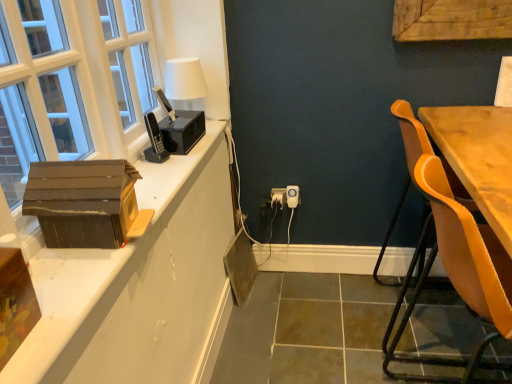
Question: Considering the relative sizes of white matte table lamp at upper left and leatherette chair at right in the image provided, is white matte table lamp at upper left thinner than leatherette chair at right?

Choices:
 (A) no
 (B) yes

Answer: (B)

Question: Is white matte table lamp at upper left not close to leatherette chair at right?

Choices:
 (A) no
 (B) yes

Answer: (A)

Question: Considering the relative sizes of white matte table lamp at upper left and leatherette chair at right in the image provided, is white matte table lamp at upper left smaller than leatherette chair at right?

Choices:
 (A) no
 (B) yes

Answer: (B)

Question: Can you confirm if white matte table lamp at upper left is wider than leatherette chair at right?

Choices:
 (A) yes
 (B) no

Answer: (B)

Question: Considering the relative positions of white matte table lamp at upper left and leatherette chair at right in the image provided, is white matte table lamp at upper left to the right of leatherette chair at right from the viewer's perspective?

Choices:
 (A) yes
 (B) no

Answer: (B)

Question: In terms of size, does brown cardboard box at lower left, placed as the 1th cardboard box when sorted from front to back, appear bigger or smaller than white plastic power outlet at center?

Choices:
 (A) small
 (B) big

Answer: (B)

Question: Choose the correct answer: Is brown cardboard box at lower left, which appears as the second cardboard box when viewed from the top, inside white plastic power outlet at center or outside it?

Choices:
 (A) outside
 (B) inside

Answer: (A)

Question: Relative to white plastic power outlet at center, is brown cardboard box at lower left, which is counted as the second cardboard box, starting from the back, in front or behind?

Choices:
 (A) behind
 (B) front

Answer: (B)

Question: From a real-world perspective, relative to white plastic power outlet at center, is brown cardboard box at lower left, the first cardboard box ordered from the bottom, vertically above or below?

Choices:
 (A) above
 (B) below

Answer: (A)

Question: In terms of size, does brown wood cabinetry at left appear bigger or smaller than white plastic electric outlet at center?

Choices:
 (A) big
 (B) small

Answer: (A)

Question: Is brown wood cabinetry at left wider or thinner than white plastic electric outlet at center?

Choices:
 (A) thin
 (B) wide

Answer: (B)

Question: Choose the correct answer: Is brown wood cabinetry at left inside white plastic electric outlet at center or outside it?

Choices:
 (A) outside
 (B) inside

Answer: (A)

Question: From a real-world perspective, is brown wood cabinetry at left above or below white plastic electric outlet at center?

Choices:
 (A) below
 (B) above

Answer: (B)

Question: From the image's perspective, is white plastic electric outlet at center above or below brown wood cabinetry at left?

Choices:
 (A) above
 (B) below

Answer: (B)

Question: Does point (294, 188) appear closer or farther from the camera than point (217, 347)?

Choices:
 (A) farther
 (B) closer

Answer: (A)